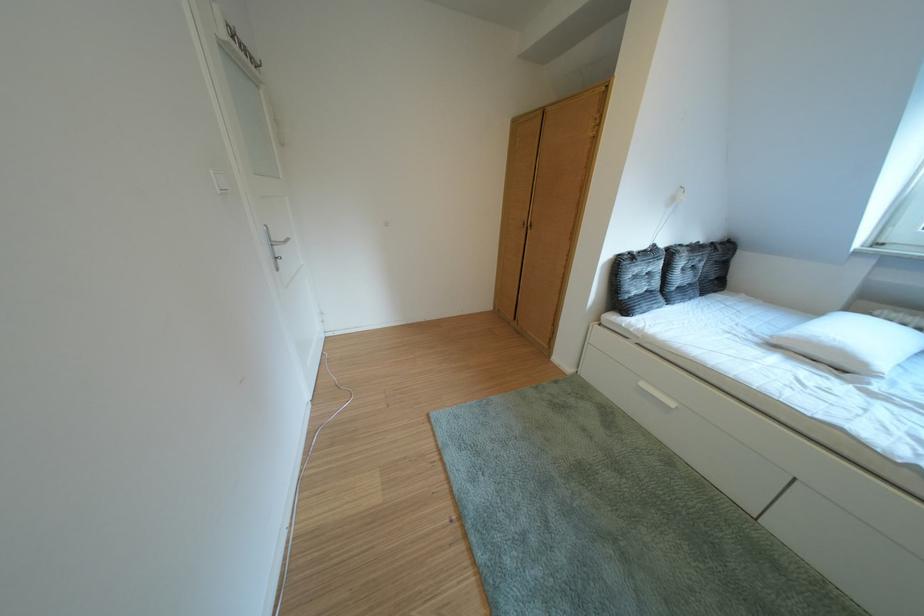
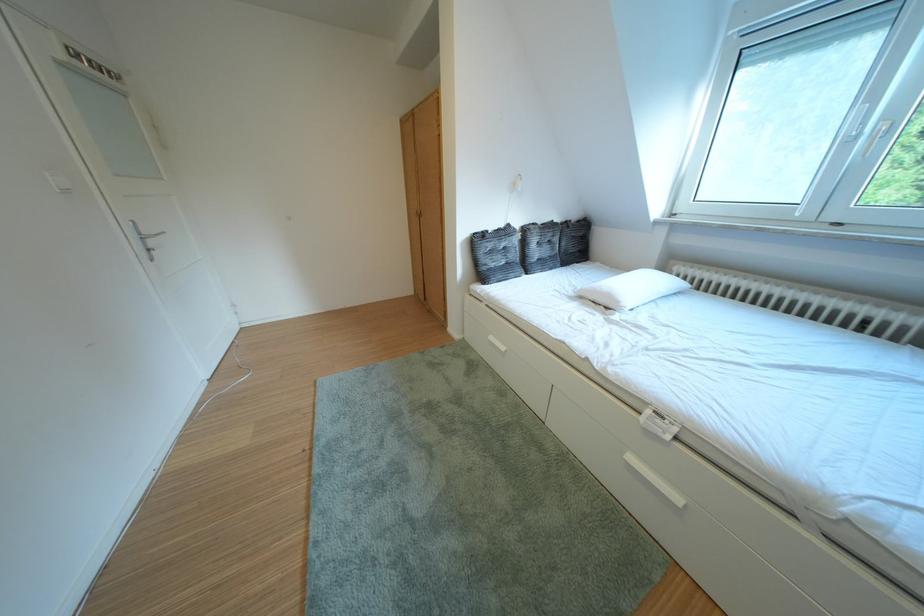
Which direction would the cameraman need to move to produce the second image?

The movement direction of the cameraman is right, backward.